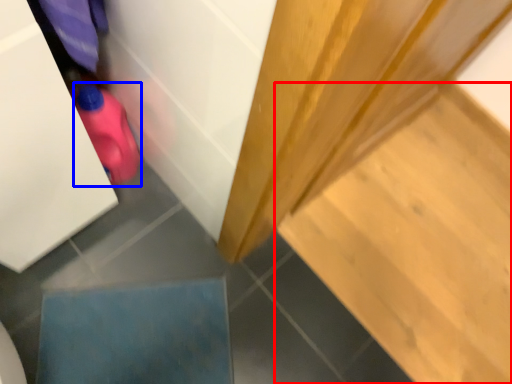
Question: Which object is closer to the camera taking this photo, stair (highlighted by a red box) or stuff (highlighted by a blue box)?

Choices:
 (A) stair
 (B) stuff

Answer: (B)